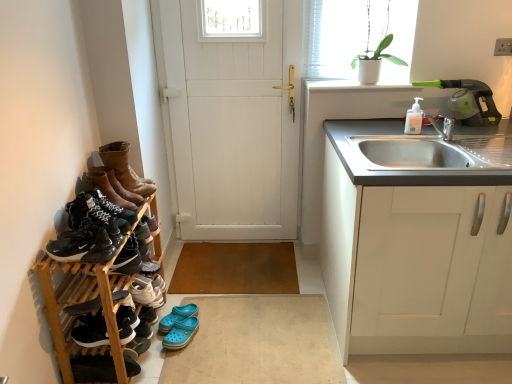
You are a GUI agent. You are given a task and a screenshot of the screen. Output one action in this format:
    pyautogui.click(x=<x>, y=<y>)
    Task: Click on the unoccupied region to the right of blue rubber clogs at lower center, the ninth footwear in the top-to-bottom sequence
    The image size is (512, 384).
    Given the screenshot: What is the action you would take?
    pyautogui.click(x=218, y=328)